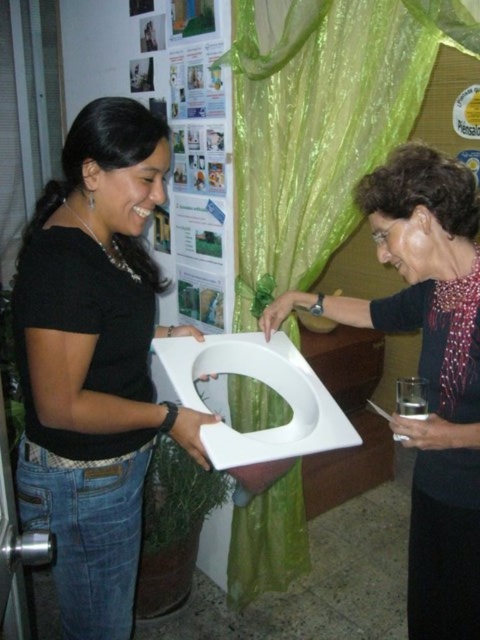
Question: Among these objects, which one is farthest from the camera?

Choices:
 (A) black matte toilet at center
 (B) green sheer curtain at center

Answer: (B)

Question: Considering the relative positions of black matte toilet at center and green sheer curtain at center in the image provided, where is black matte toilet at center located with respect to green sheer curtain at center?

Choices:
 (A) below
 (B) above

Answer: (A)

Question: Is black matte toilet at center below green sheer curtain at center?

Choices:
 (A) yes
 (B) no

Answer: (A)

Question: Does black matte toilet at center have a smaller size compared to green sheer curtain at center?

Choices:
 (A) yes
 (B) no

Answer: (A)

Question: Which point is farther to the camera?

Choices:
 (A) (12, 301)
 (B) (369, 16)

Answer: (B)